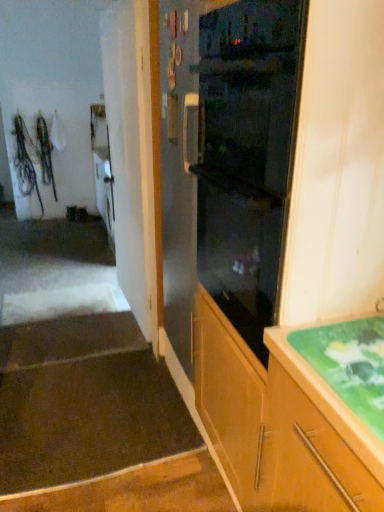
Question: From the image's perspective, is dark brown carpet at lower left, the first stairwell viewed from the front, above or below black glass oven at center?

Choices:
 (A) above
 (B) below

Answer: (B)

Question: Relative to black glass oven at center, is dark brown carpet at lower left, the first stairwell viewed from the front, in front or behind?

Choices:
 (A) behind
 (B) front

Answer: (A)

Question: Which object is positioned farthest from the green glossy countertop at lower right?

Choices:
 (A) brown carpet at lower left, the 2th stairwell positioned from the front
 (B) dark brown carpet at lower left, positioned as the second stairwell in back-to-front order
 (C) black glass oven at center

Answer: (A)

Question: Estimate the real-world distances between objects in this image. Which object is closer to the brown carpet at lower left, the 2th stairwell positioned from the front?

Choices:
 (A) dark brown carpet at lower left, the first stairwell viewed from the front
 (B) black glass oven at center
 (C) green glossy countertop at lower right

Answer: (A)